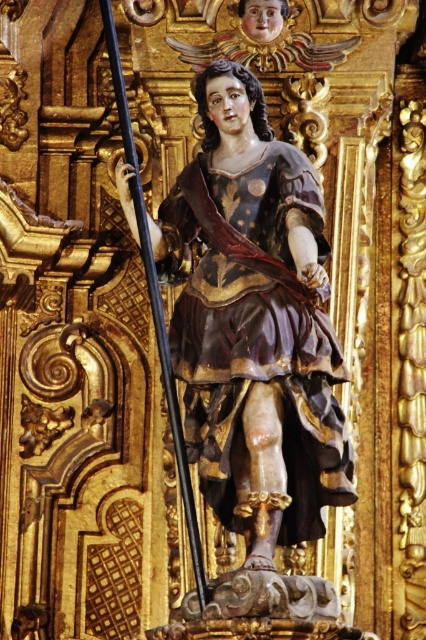
You are an art restorer examining the wooden statue at center and the black polished wood pole at center. Which object is positioned higher in the image?

The wooden statue at center is positioned higher than the black polished wood pole at center.

You are an art conservator examining the statue and pole in the image. The wooden statue at center and the black polished wood pole at center are both made of different types of wood. If you want to ensure proper preservation, which object should be placed closer to the wall to prevent exposure to direct sunlight coming from the left side of the room?

The wooden statue at center should be placed closer to the wall because it is positioned on the right side of the black polished wood pole at center, meaning it is farther from the wall. Moving it closer would protect it from sunlight entering from the left.

You are a visitor standing in front of the wooden statue at center. The statue is part of a museum exhibit. The museum requires that all visitors maintain a minimum distance of 1 meter from all exhibits for preservation purposes. Can you safely stand at your current position without violating the museum rules?

A: The wooden statue at center and viewer are 78.78 meters apart, so yes, you can safely stand at your current position without violating the museum rules since the distance is well above the required 1 meter minimum.